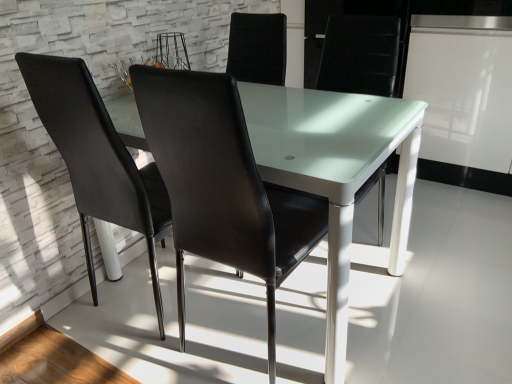
Question: Should I look upward or downward to see transparent glass table at center?

Choices:
 (A) up
 (B) down

Answer: (B)

Question: Is black leather chair at center, which appears as the 1th chair when viewed from the right, bigger than black leather chair at left, positioned as the first chair in left-to-right order?

Choices:
 (A) no
 (B) yes

Answer: (B)

Question: Is black leather chair at left, positioned as the first chair in left-to-right order, surrounded by black leather chair at center, acting as the 2th chair starting from the left?

Choices:
 (A) yes
 (B) no

Answer: (B)

Question: Does black leather chair at center, acting as the 2th chair starting from the left, come in front of black leather chair at left, placed as the second chair when sorted from right to left?

Choices:
 (A) yes
 (B) no

Answer: (A)

Question: Does black leather chair at center, which appears as the 1th chair when viewed from the right, turn towards black leather chair at left, positioned as the first chair in left-to-right order?

Choices:
 (A) yes
 (B) no

Answer: (B)

Question: Considering the relative sizes of black leather chair at center, which appears as the 1th chair when viewed from the right, and black leather chair at left, positioned as the first chair in left-to-right order, in the image provided, is black leather chair at center, which appears as the 1th chair when viewed from the right, wider than black leather chair at left, positioned as the first chair in left-to-right order,?

Choices:
 (A) yes
 (B) no

Answer: (A)

Question: Is black leather chair at center, acting as the 2th chair starting from the left, in contact with black leather chair at left, positioned as the first chair in left-to-right order?

Choices:
 (A) no
 (B) yes

Answer: (A)

Question: Is black leather chair at left, placed as the second chair when sorted from right to left, bigger than transparent glass table at center?

Choices:
 (A) yes
 (B) no

Answer: (B)

Question: Are black leather chair at left, positioned as the first chair in left-to-right order, and transparent glass table at center beside each other?

Choices:
 (A) yes
 (B) no

Answer: (B)

Question: Is black leather chair at left, placed as the second chair when sorted from right to left, facing away from transparent glass table at center?

Choices:
 (A) yes
 (B) no

Answer: (A)

Question: Can you confirm if black leather chair at left, positioned as the first chair in left-to-right order, is positioned to the right of transparent glass table at center?

Choices:
 (A) yes
 (B) no

Answer: (B)

Question: Is black leather chair at left, placed as the second chair when sorted from right to left, shorter than transparent glass table at center?

Choices:
 (A) yes
 (B) no

Answer: (B)

Question: Does black leather chair at center, which appears as the 1th chair when viewed from the right, come in front of transparent glass table at center?

Choices:
 (A) no
 (B) yes

Answer: (B)